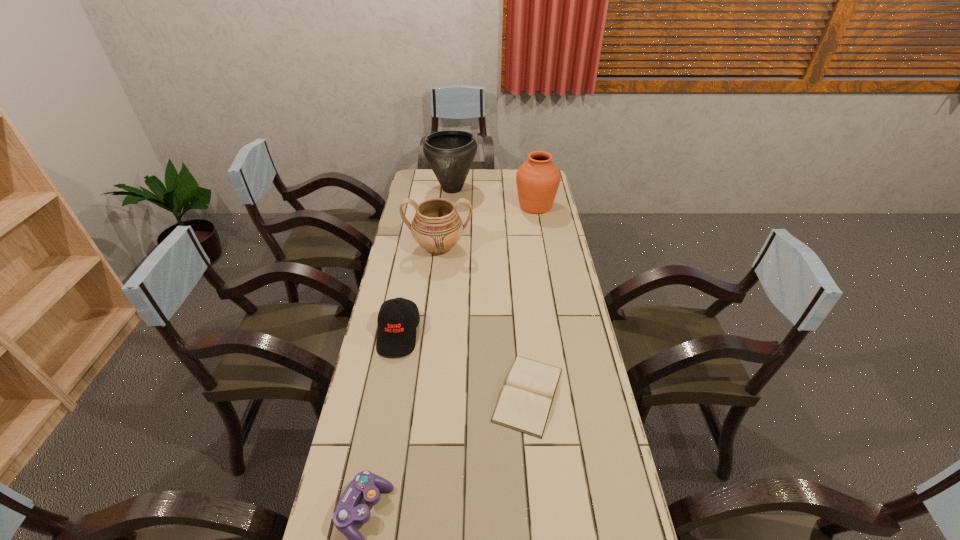
Identify the location of urn that is positioned at the right edge. (538, 178).

The width and height of the screenshot is (960, 540). Identify the location of Bible at the right edge. (524, 405).

Locate an element on the screen. The width and height of the screenshot is (960, 540). object at the far left corner is located at coordinates (450, 153).

In the image, there is a desktop. Where is `free region at the far edge`? This screenshot has height=540, width=960. free region at the far edge is located at coordinates (489, 173).

This screenshot has width=960, height=540. In the image, there is a desktop. What are the coordinates of `vacant area at the left edge` in the screenshot? It's located at (428, 267).

You are a GUI agent. You are given a task and a screenshot of the screen. Output one action in this format:
    pyautogui.click(x=<x>, y=<y>)
    Task: Click on the free space at the right edge of the desktop
    Image resolution: width=960 pixels, height=540 pixels.
    Given the screenshot: What is the action you would take?
    pyautogui.click(x=561, y=430)

Locate an element on the screen. The width and height of the screenshot is (960, 540). vacant space at the far left corner is located at coordinates (424, 174).

This screenshot has height=540, width=960. In order to click on vacant region between the shortest object and the third farthest object in this screenshot , I will do `click(484, 321)`.

Find the location of a particular element. The height and width of the screenshot is (540, 960). vacant area that lies between the nearest urn and the baseball cap is located at coordinates (419, 291).

This screenshot has width=960, height=540. In order to click on free spot between the fourth nearest object and the rightmost urn in this screenshot , I will do `click(487, 227)`.